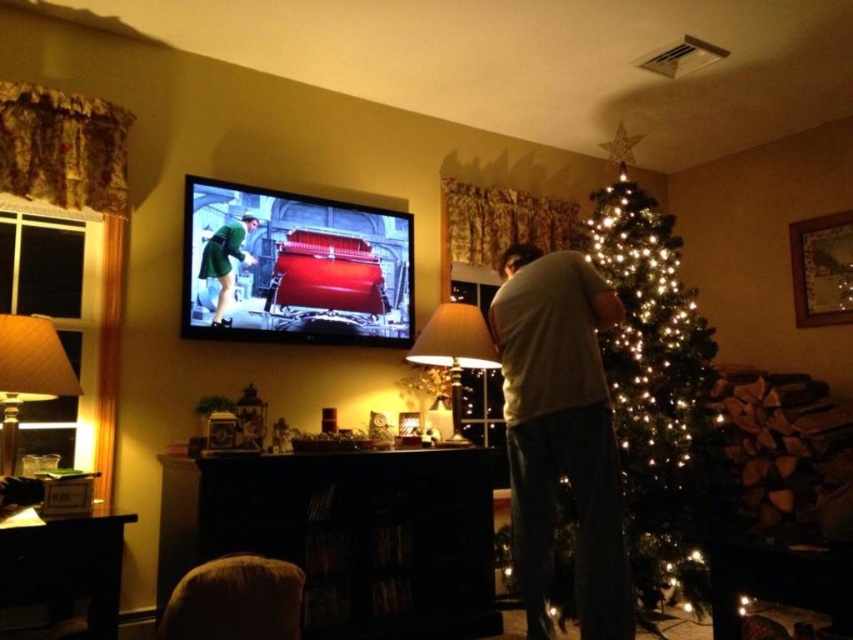
Question: Which point is farther from the camera taking this photo?

Choices:
 (A) (541, 413)
 (B) (468, 365)
 (C) (210, 241)

Answer: (B)

Question: From the image, what is the correct spatial relationship of dark wood entertainment center at lower center in relation to illuminated green tree at center?

Choices:
 (A) below
 (B) above

Answer: (A)

Question: Can you confirm if dark wood entertainment center at lower center is thinner than green matte dress at upper left?

Choices:
 (A) no
 (B) yes

Answer: (A)

Question: Does illuminated green tree at center appear on the right side of green matte dress at upper left?

Choices:
 (A) no
 (B) yes

Answer: (B)

Question: Based on their relative distances, which object is nearer to the green matte dress at upper left?

Choices:
 (A) illuminated green tree at center
 (B) quilted fabric lampshade at left
 (C) dark wood entertainment center at lower center

Answer: (B)

Question: Among these objects, which one is farthest from the camera?

Choices:
 (A) dark wood entertainment center at lower center
 (B) matte white lampshade at center
 (C) green matte dress at upper left
 (D) white cotton shirt at right

Answer: (B)